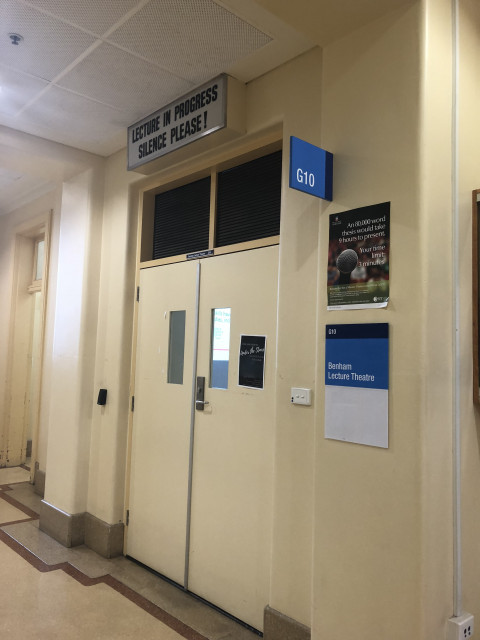
Where is `blocked off window`? The image size is (480, 640). blocked off window is located at coordinates (193, 221), (238, 220).